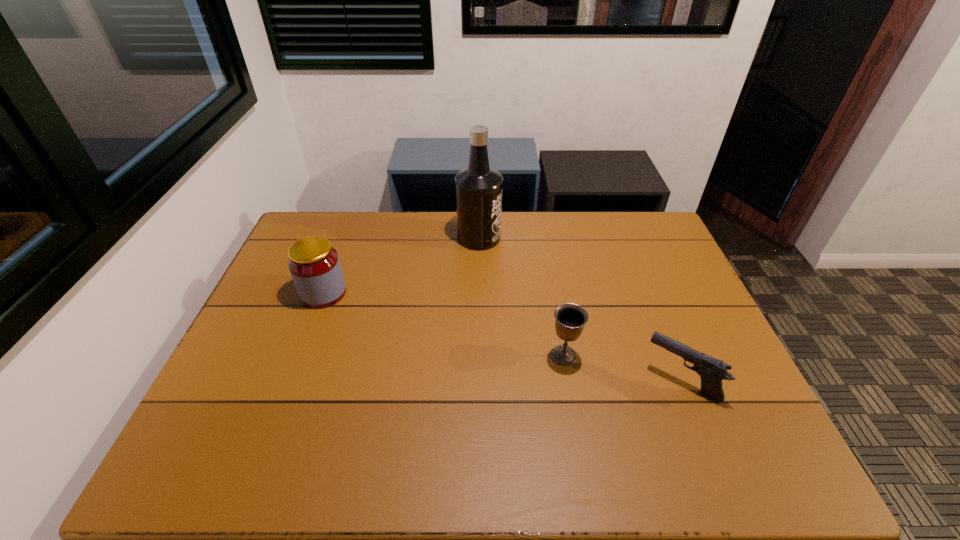
The image size is (960, 540). In the image, there is a desktop. Identify the location of vacant space at the far left corner. (347, 223).

Where is `free space at the far right corner of the desktop`? Image resolution: width=960 pixels, height=540 pixels. free space at the far right corner of the desktop is located at coordinates (654, 215).

The width and height of the screenshot is (960, 540). In the image, there is a desktop. Identify the location of free space at the near right corner. (768, 462).

The image size is (960, 540). What are the coordinates of `blank region between the third object from right to left and the third nearest object` in the screenshot? It's located at (401, 265).

Where is `vacant point located between the jar and the tallest object`? vacant point located between the jar and the tallest object is located at coordinates (401, 265).

At what (x,y) coordinates should I click in order to perform the action: click on empty space that is in between the jar and the rightmost object. Please return your answer as a coordinate pair (x, y). The image size is (960, 540). Looking at the image, I should click on (502, 337).

Where is `vacant point located between the jar and the chalice`? vacant point located between the jar and the chalice is located at coordinates (444, 324).

At what (x,y) coordinates should I click in order to perform the action: click on free area in between the second object from right to left and the shortest object. Please return your answer as a coordinate pair (x, y). Looking at the image, I should click on (622, 368).

Where is `free spot between the third object from left to right and the shortest object`? The height and width of the screenshot is (540, 960). free spot between the third object from left to right and the shortest object is located at coordinates (622, 368).

Identify the location of empty space that is in between the jar and the gun. The image size is (960, 540). (502, 337).